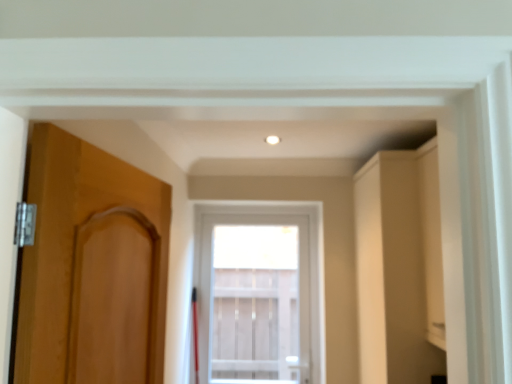
Question: Considering the relative sizes of matte wood door at left and matte beige cabinet at right in the image provided, is matte wood door at left bigger than matte beige cabinet at right?

Choices:
 (A) yes
 (B) no

Answer: (B)

Question: From a real-world perspective, is matte wood door at left beneath matte beige cabinet at right?

Choices:
 (A) yes
 (B) no

Answer: (B)

Question: Can you see matte wood door at left touching matte beige cabinet at right?

Choices:
 (A) yes
 (B) no

Answer: (B)

Question: From the image's perspective, does matte wood door at left appear higher than matte beige cabinet at right?

Choices:
 (A) no
 (B) yes

Answer: (B)

Question: Does matte wood door at left have a greater height compared to matte beige cabinet at right?

Choices:
 (A) no
 (B) yes

Answer: (A)

Question: From a real-world perspective, is matte wood door at left on top of matte beige cabinet at right?

Choices:
 (A) yes
 (B) no

Answer: (A)

Question: Can you confirm if clear glass window at center is thinner than matte beige cabinet at right?

Choices:
 (A) no
 (B) yes

Answer: (B)

Question: Is clear glass window at center to the right of matte beige cabinet at right from the viewer's perspective?

Choices:
 (A) no
 (B) yes

Answer: (A)

Question: From a real-world perspective, is clear glass window at center beneath matte beige cabinet at right?

Choices:
 (A) no
 (B) yes

Answer: (B)

Question: From a real-world perspective, is clear glass window at center physically above matte beige cabinet at right?

Choices:
 (A) yes
 (B) no

Answer: (B)

Question: Could you tell me if clear glass window at center is facing matte beige cabinet at right?

Choices:
 (A) yes
 (B) no

Answer: (B)

Question: Would you say matte beige cabinet at right is part of clear glass window at center's contents?

Choices:
 (A) no
 (B) yes

Answer: (A)

Question: Considering the relative sizes of matte wood door at left and clear glass window at center in the image provided, is matte wood door at left wider than clear glass window at center?

Choices:
 (A) no
 (B) yes

Answer: (A)